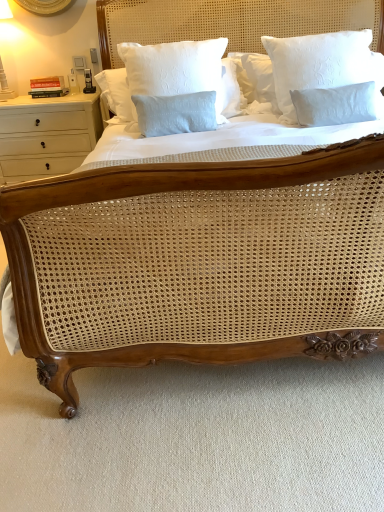
Question: From the image's perspective, is light blue cotton pillow at center, which appears as the second pillow when viewed from the right, over white wood drawer at left?

Choices:
 (A) no
 (B) yes

Answer: (B)

Question: Is white wood drawer at left at the back of light blue cotton pillow at center, the 1th pillow positioned from the left?

Choices:
 (A) yes
 (B) no

Answer: (B)

Question: Considering the relative positions of light blue cotton pillow at center, which appears as the second pillow when viewed from the right, and white wood drawer at left in the image provided, is light blue cotton pillow at center, which appears as the second pillow when viewed from the right, to the left of white wood drawer at left from the viewer's perspective?

Choices:
 (A) yes
 (B) no

Answer: (B)

Question: From a real-world perspective, is light blue cotton pillow at center, which appears as the second pillow when viewed from the right, positioned under white wood drawer at left based on gravity?

Choices:
 (A) yes
 (B) no

Answer: (B)

Question: Can you confirm if light blue cotton pillow at center, the 1th pillow positioned from the left, is thinner than white wood drawer at left?

Choices:
 (A) yes
 (B) no

Answer: (A)

Question: Can we say light blue cotton pillow at center, the 1th pillow positioned from the left, lies outside white wood drawer at left?

Choices:
 (A) no
 (B) yes

Answer: (B)

Question: Can you confirm if light blue cotton pillow at center, the 1th pillow positioned from the left, is shorter than white textured pillow at upper right, which ranks as the 1th pillow in right-to-left order?

Choices:
 (A) yes
 (B) no

Answer: (A)

Question: Is light blue cotton pillow at center, the 1th pillow positioned from the left, placed right next to white textured pillow at upper right, which is counted as the 2th pillow, starting from the left?

Choices:
 (A) no
 (B) yes

Answer: (A)

Question: Is light blue cotton pillow at center, the 1th pillow positioned from the left, smaller than white textured pillow at upper right, which ranks as the 1th pillow in right-to-left order?

Choices:
 (A) yes
 (B) no

Answer: (A)

Question: From the image's perspective, is light blue cotton pillow at center, the 1th pillow positioned from the left, on white textured pillow at upper right, which is counted as the 2th pillow, starting from the left?

Choices:
 (A) yes
 (B) no

Answer: (B)

Question: From a real-world perspective, is light blue cotton pillow at center, which appears as the second pillow when viewed from the right, over white textured pillow at upper right, which is counted as the 2th pillow, starting from the left?

Choices:
 (A) yes
 (B) no

Answer: (B)

Question: Is light blue cotton pillow at center, which appears as the second pillow when viewed from the right, not close to white textured pillow at upper right, which ranks as the 1th pillow in right-to-left order?

Choices:
 (A) no
 (B) yes

Answer: (A)

Question: Considering the relative sizes of white textured pillow at upper right, which ranks as the 1th pillow in right-to-left order, and light blue cotton pillow at center, which appears as the second pillow when viewed from the right, in the image provided, is white textured pillow at upper right, which ranks as the 1th pillow in right-to-left order, taller than light blue cotton pillow at center, which appears as the second pillow when viewed from the right,?

Choices:
 (A) no
 (B) yes

Answer: (B)